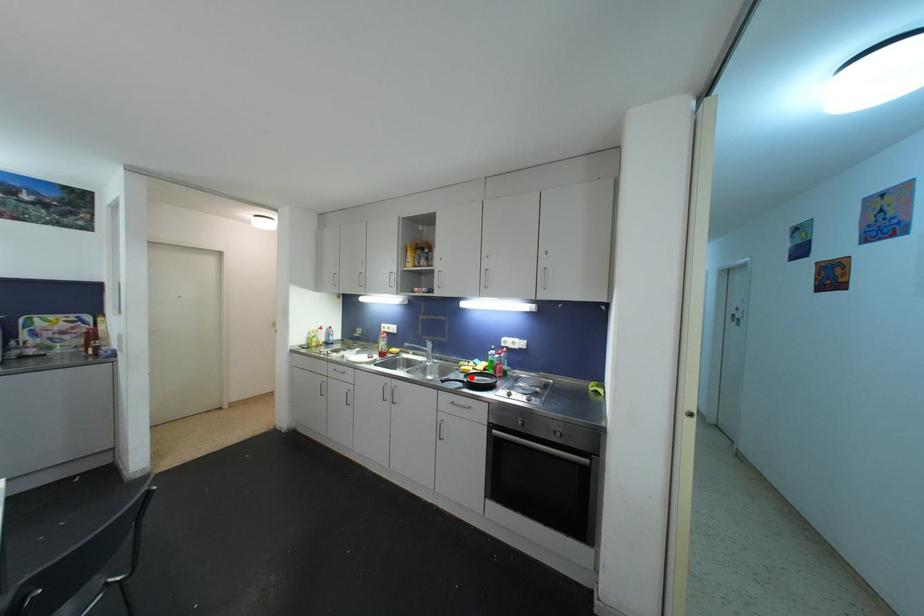
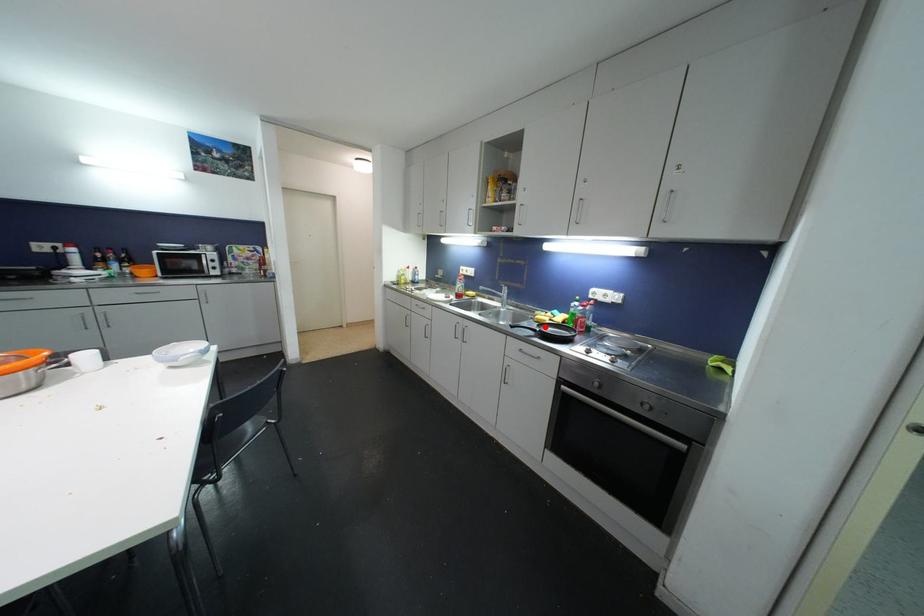
I am providing you with two images of the same scene from different viewpoints. A red point is marked on the first image and another point is marked on the second image. Is the marked point in image1 the same physical position as the marked point in image2?

Yes